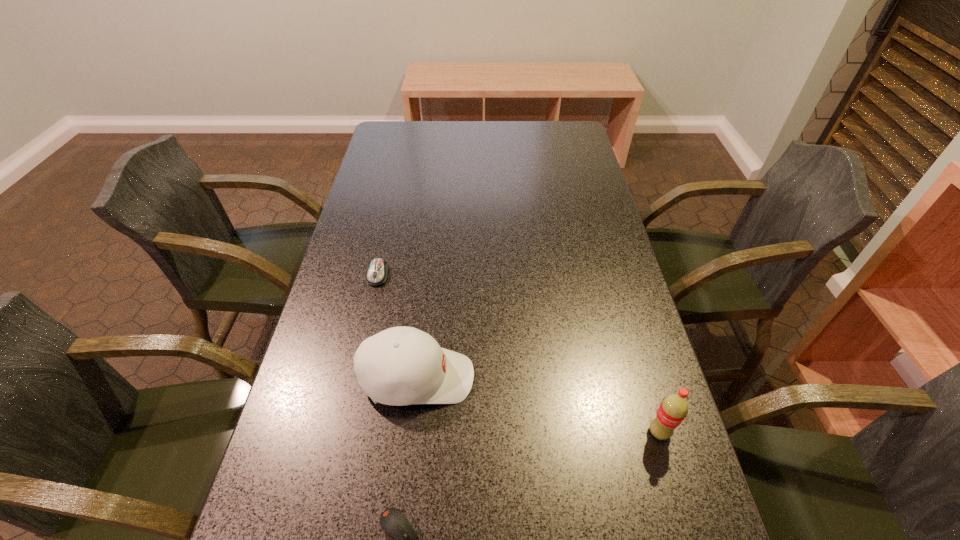
Find the location of a particular element. the rightmost object is located at coordinates (673, 409).

I want to click on the tallest object, so click(x=673, y=409).

Find the location of a particular element. the third nearest object is located at coordinates (399, 366).

Identify the location of the second tallest object. The height and width of the screenshot is (540, 960). (399, 366).

At what (x,y) coordinates should I click in order to perform the action: click on the farthest object. Please return your answer as a coordinate pair (x, y). Looking at the image, I should click on (377, 273).

Where is `the taller computer mouse`? the taller computer mouse is located at coordinates (377, 273).

This screenshot has height=540, width=960. In order to click on free space located on the back of the rightmost object in this screenshot , I will do `click(621, 302)`.

I want to click on vacant space located 0.230m on the front-facing side of the third nearest object, so click(583, 378).

The width and height of the screenshot is (960, 540). What are the coordinates of `blank space located on the wheel side of the farther computer mouse` in the screenshot? It's located at click(x=369, y=318).

Where is `baseball cap at the left edge`? The width and height of the screenshot is (960, 540). baseball cap at the left edge is located at coordinates (x=399, y=366).